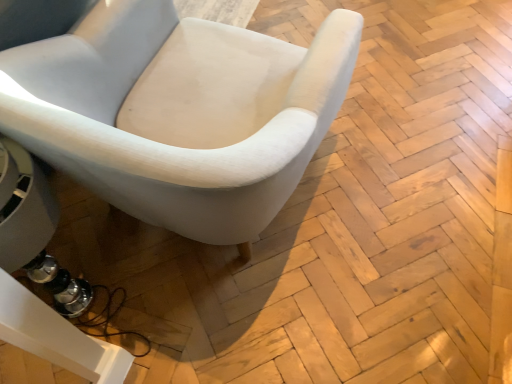
Question: Should I look upward or downward to see white fabric chair at center?

Choices:
 (A) down
 (B) up

Answer: (B)